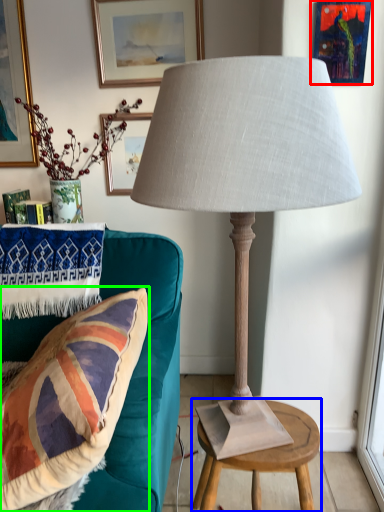
Question: Which object is the closest to the picture frame (highlighted by a red box)? Choose among these: table (highlighted by a blue box) or pillow (highlighted by a green box).

Choices:
 (A) table
 (B) pillow

Answer: (B)